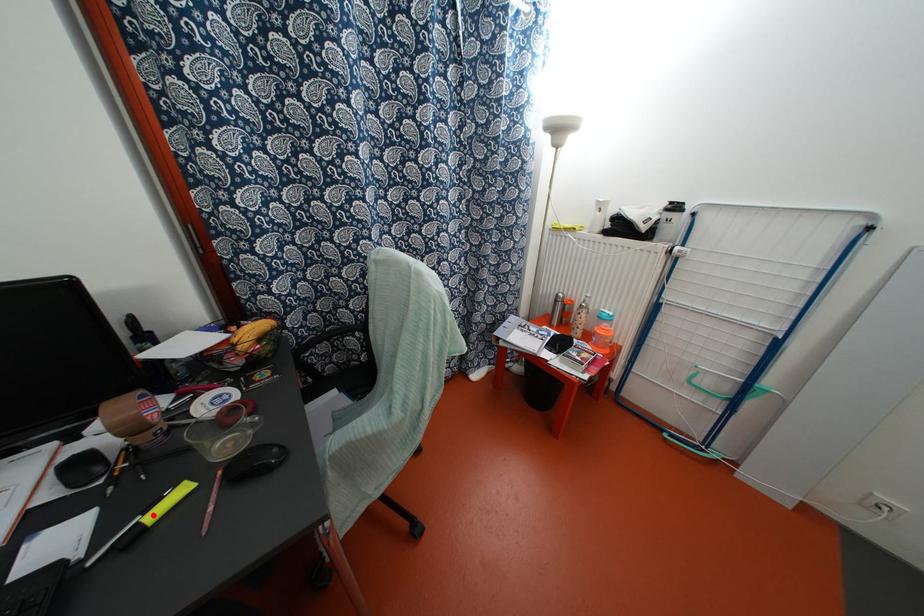
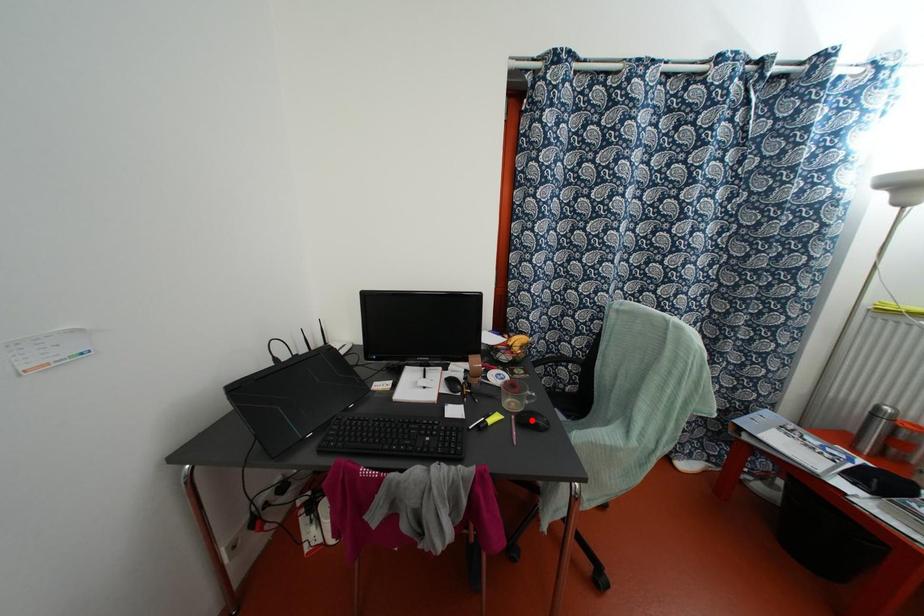
In the scene shown: I am providing you with two images of the same scene from different viewpoints. A red point is marked on the first image and another point is marked on the second image. Is the marked point in image1 the same physical position as the marked point in image2?

No